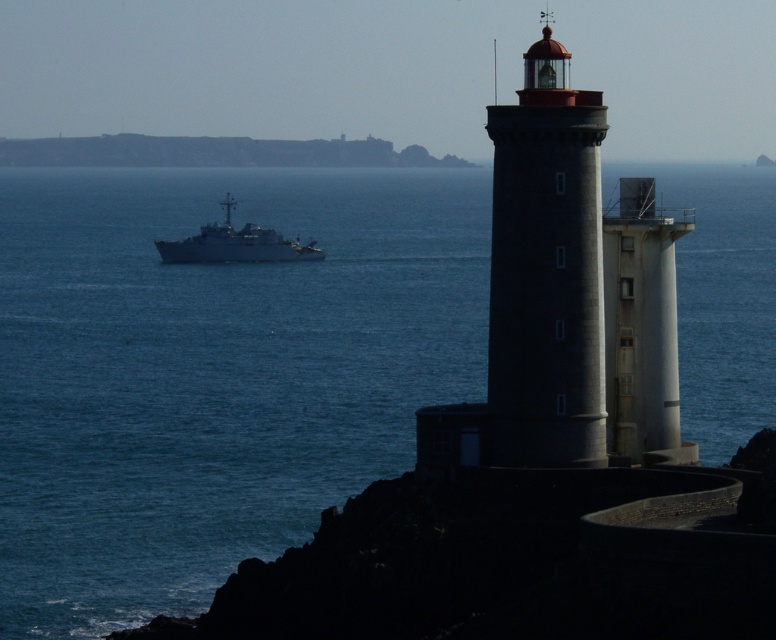
Is blue water at center behind white matte ship at center?

That is False.

At what (x,y) coordinates should I click in order to perform the action: click on blue water at center. Please return your answer as a coordinate pair (x, y). Looking at the image, I should click on (210, 372).

Between point (566, 438) and point (244, 228), which one is positioned in front?

Positioned in front is point (566, 438).

In the scene shown: Who is lower down, smooth gray lighthouse at center or white matte ship at center?

smooth gray lighthouse at center is below.

Does point (584, 93) come in front of point (314, 250)?

Yes, point (584, 93) is in front of point (314, 250).

This screenshot has height=640, width=776. I want to click on smooth gray lighthouse at center, so click(x=546, y=272).

Is point (283, 275) positioned before point (541, 388)?

No.

Is blue water at center thinner than smooth gray lighthouse at center?

Incorrect, blue water at center's width is not less than smooth gray lighthouse at center's.

Does point (476, 196) come behind point (508, 164)?

Yes, point (476, 196) is behind point (508, 164).

This screenshot has width=776, height=640. In order to click on blue water at center in this screenshot , I will do `click(210, 372)`.